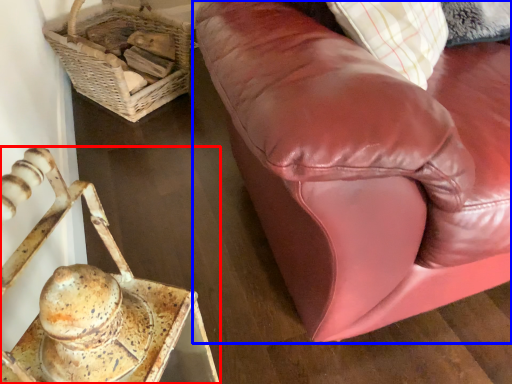
Question: Which object is closer to the camera taking this photo, furniture (highlighted by a red box) or studio couch (highlighted by a blue box)?

Choices:
 (A) furniture
 (B) studio couch

Answer: (A)